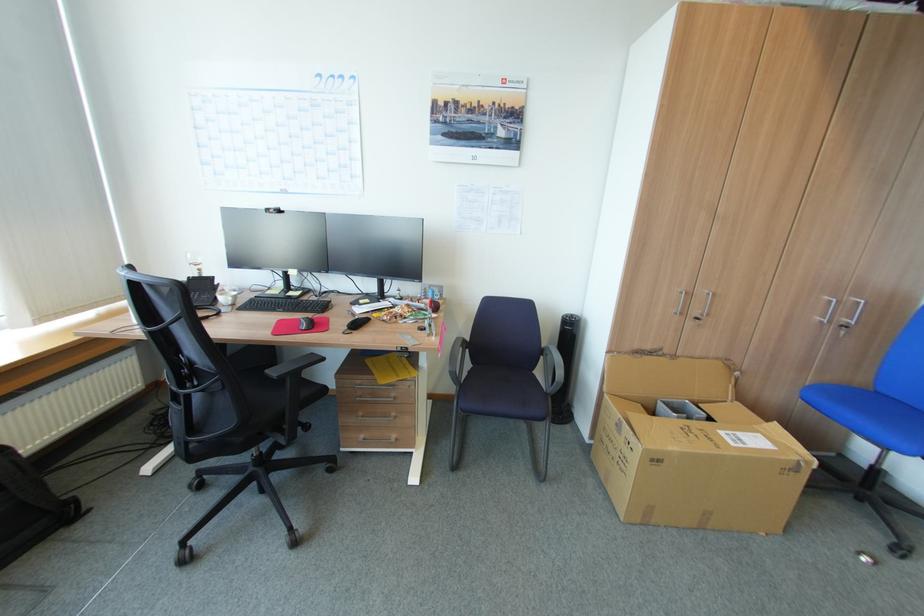
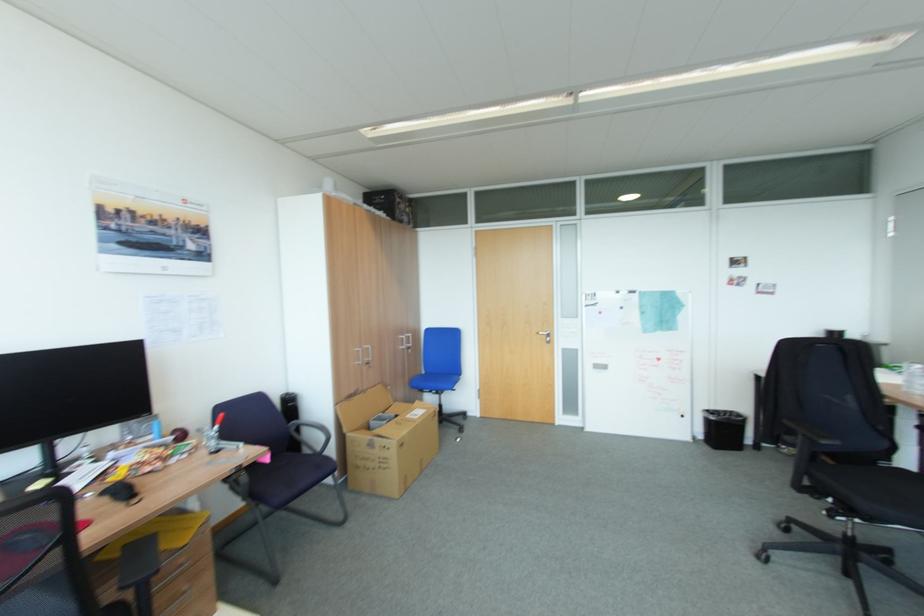
Locate, in the second image, the point that corresponds to (699,312) in the first image.

(371, 360)